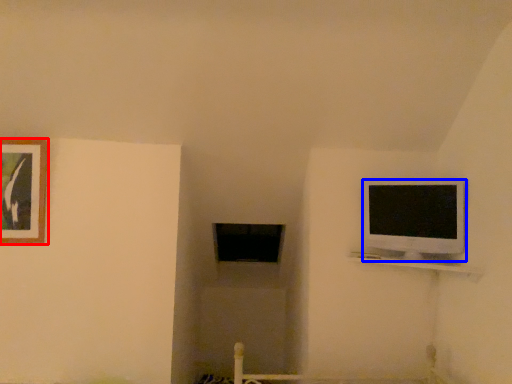
Question: Which object is further to the camera taking this photo, picture frame (highlighted by a red box) or television (highlighted by a blue box)?

Choices:
 (A) picture frame
 (B) television

Answer: (A)